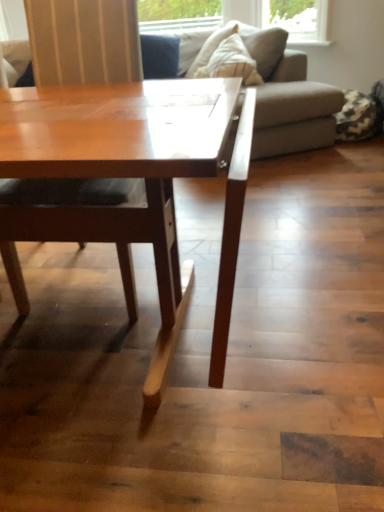
Question: From the image's perspective, is gray fabric couch at upper center positioned above or below matte wood chair at center?

Choices:
 (A) above
 (B) below

Answer: (A)

Question: Considering their positions, is gray fabric couch at upper center located in front of or behind matte wood chair at center?

Choices:
 (A) behind
 (B) front

Answer: (A)

Question: Visually, is gray fabric couch at upper center positioned to the left or to the right of matte wood chair at center?

Choices:
 (A) left
 (B) right

Answer: (B)

Question: Visually, is matte wood chair at center positioned to the left or to the right of gray fabric couch at upper center?

Choices:
 (A) right
 (B) left

Answer: (B)

Question: From a real-world perspective, is matte wood chair at center positioned above or below gray fabric couch at upper center?

Choices:
 (A) above
 (B) below

Answer: (A)

Question: In terms of height, does matte wood chair at center look taller or shorter compared to gray fabric couch at upper center?

Choices:
 (A) tall
 (B) short

Answer: (A)

Question: Is point pos(124,25) closer or farther from the camera than point pos(269,144)?

Choices:
 (A) closer
 (B) farther

Answer: (A)